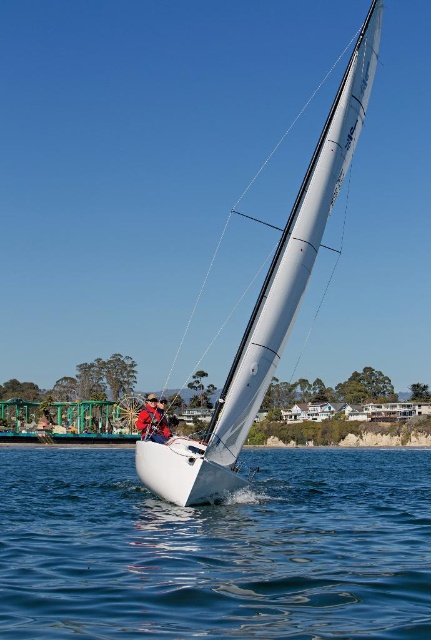
Based on the photo, does clear blue water at center come in front of white glossy sailboat at center?

Yes, it is in front of white glossy sailboat at center.

Between point (278, 458) and point (224, 419), which one is positioned in front?

Positioned in front is point (224, 419).

Which is in front, point (112, 532) or point (233, 376)?

Positioned in front is point (233, 376).

Locate an element on the screen. clear blue water at center is located at coordinates (215, 548).